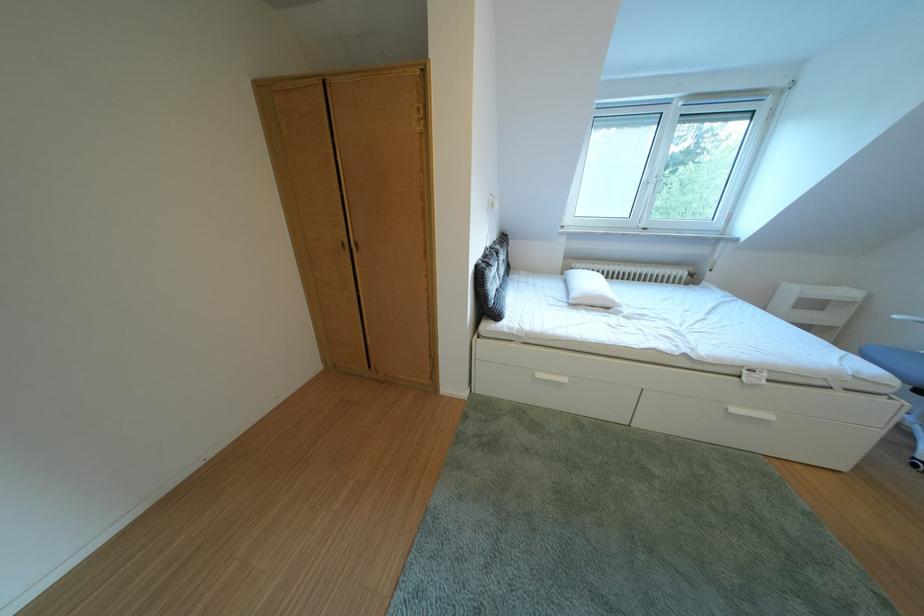
Where is `chair sitting surface`? The width and height of the screenshot is (924, 616). chair sitting surface is located at coordinates (907, 350).